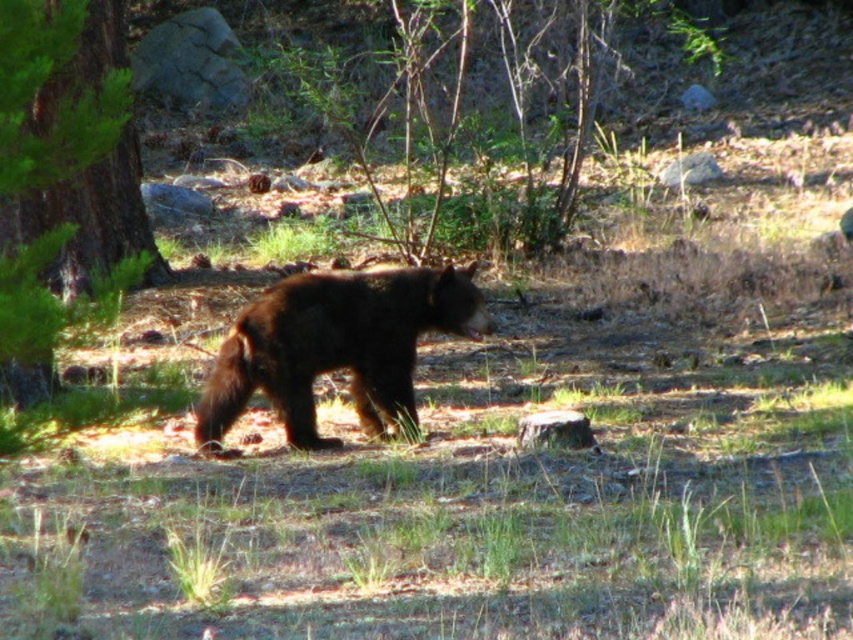
Who is more forward, (296, 394) or (13, 204)?

Point (13, 204) is in front.

The width and height of the screenshot is (853, 640). In order to click on shiny dark brown bear at center in this screenshot , I will do `click(335, 346)`.